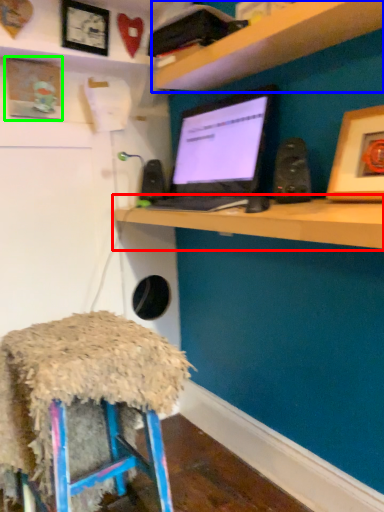
Question: Which object is positioned farthest from computer (highlighted by a red box)? Select from shelf (highlighted by a blue box) and picture frame (highlighted by a green box).

Choices:
 (A) shelf
 (B) picture frame

Answer: (B)